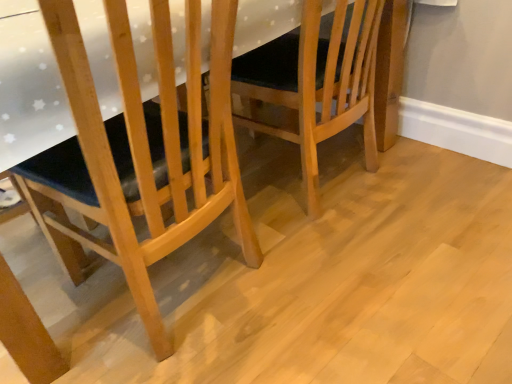
Identify the location of vacant space in front of light brown wooden chair at center, placed as the second chair when sorted from left to right. The width and height of the screenshot is (512, 384). (382, 281).